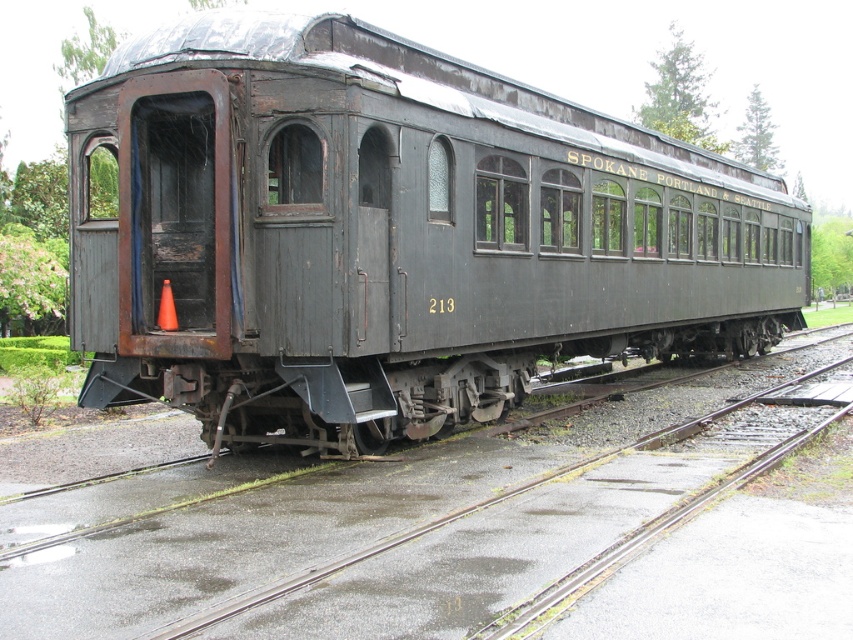
You are standing at the center of a platform and see the rusty metal train car at center. If you walk straight towards it, will you hit the train car at center?

Yes, because the rusty metal train car at center is located at point (389, 234), which is directly in front of your position at the center of the platform.

You are a railway inspector checking the condition of the tracks and the train car. Based on the image, which object is bigger in size between the rusty metal train car at center and the rusty metal track at lower center?

The rusty metal train car at center has a larger size compared to the rusty metal track at lower center, so the rusty metal train car at center is bigger.

You are standing on the platform next to the Spokane Portland and Seattle train car number 213. You notice two points marked on the train car. One is at coordinate point (x=608, y=216) and the other at point (x=113, y=538). If you were to walk towards the train car, which point would you encounter first?

Point (x=608, y=216) is further to the viewer than point (x=113, y=538), so you would encounter point (x=608, y=216) first as you approach the train car.